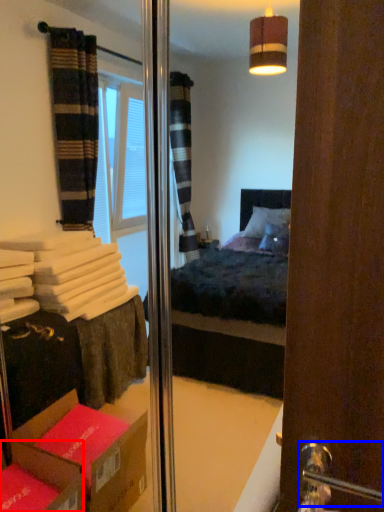
Question: Among these objects, which one is nearest to the camera, cardboard box (highlighted by a red box) or door handle (highlighted by a blue box)?

Choices:
 (A) cardboard box
 (B) door handle

Answer: (B)